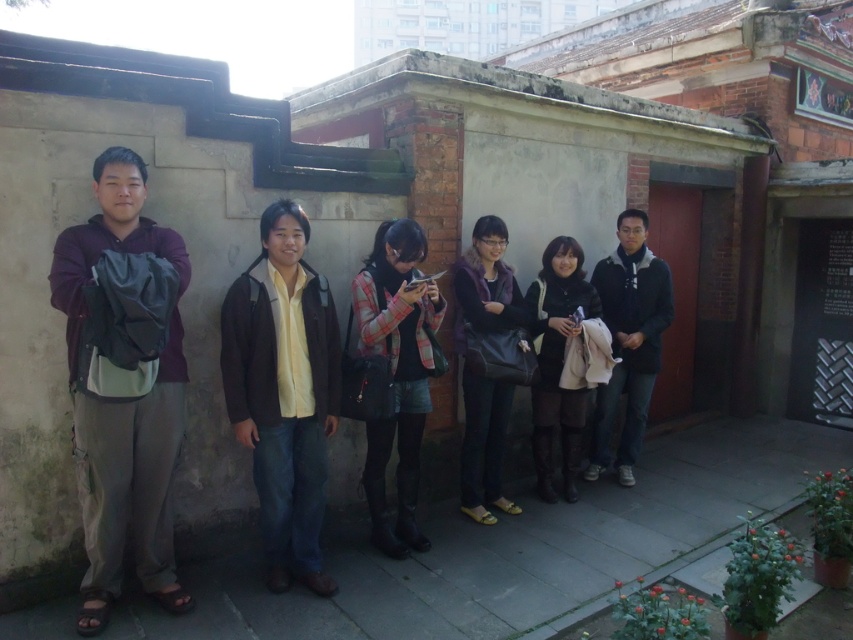
Question: Which is farther from the dark blue jacket at center?

Choices:
 (A) dark brown leather boots at center
 (B) plaid fabric skirt at center
 (C) purple fuzzy vest at center
 (D) dark purple fleece jacket at left

Answer: (D)

Question: Which of these objects is positioned farthest from the purple fuzzy vest at center?

Choices:
 (A) dark blue jacket at center
 (B) plaid fabric skirt at center
 (C) dark purple fleece jacket at left
 (D) dark brown leather boots at center

Answer: (C)

Question: Is plaid fabric skirt at center below dark blue jacket at center?

Choices:
 (A) no
 (B) yes

Answer: (B)

Question: Does dark purple fleece jacket at left appear over dark brown leather boots at center?

Choices:
 (A) no
 (B) yes

Answer: (B)

Question: Which object is positioned closest to the dark brown leather boots at center?

Choices:
 (A) dark blue jacket at center
 (B) purple fuzzy vest at center
 (C) plaid fabric skirt at center
 (D) dark purple fleece jacket at left

Answer: (B)

Question: Is dark blue jacket at center wider than purple fuzzy vest at center?

Choices:
 (A) no
 (B) yes

Answer: (B)